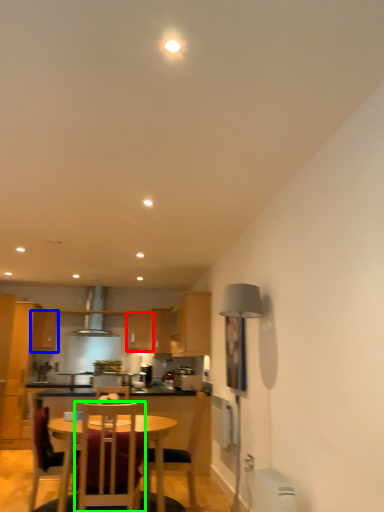
Question: Which object is positioned closest to cabinetry (highlighted by a red box)? Select from cabinetry (highlighted by a blue box) and chair (highlighted by a green box).

Choices:
 (A) cabinetry
 (B) chair

Answer: (A)